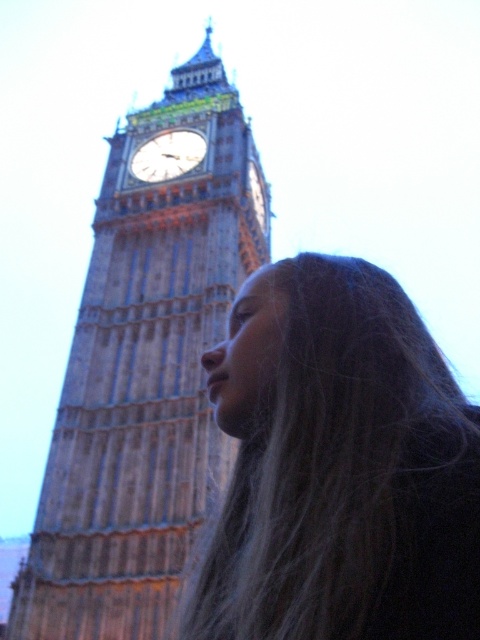
Question: Which point is farther to the camera?

Choices:
 (A) (135, 168)
 (B) (266, 211)
 (C) (314, 292)

Answer: (B)

Question: Is dark brown hair at center to the left of stone clock tower at upper left from the viewer's perspective?

Choices:
 (A) no
 (B) yes

Answer: (A)

Question: Is gold-toned metal clock at upper center smaller than gold-colored metal clock at upper center?

Choices:
 (A) no
 (B) yes

Answer: (A)

Question: Among these points, which one is nearest to the camera?

Choices:
 (A) [447, 404]
 (B) [184, 168]

Answer: (A)

Question: Which of the following is the closest to the observer?

Choices:
 (A) dark brown hair at center
 (B) stone clock tower at upper left
 (C) gold-toned metal clock at upper center
 (D) gold-colored metal clock at upper center

Answer: (A)

Question: Can you confirm if stone clock tower at upper left is wider than gold-toned metal clock at upper center?

Choices:
 (A) no
 (B) yes

Answer: (B)